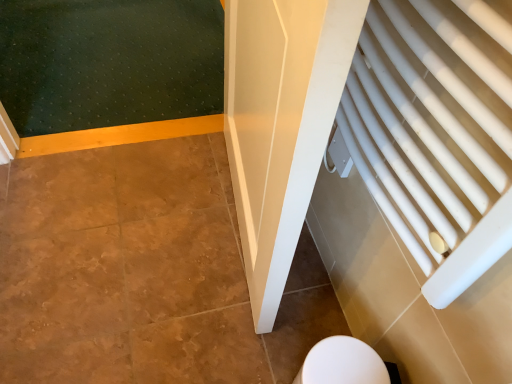
Question: From the image's perspective, is white glossy toilet at lower center located above or below white plastic radiator at right?

Choices:
 (A) below
 (B) above

Answer: (A)

Question: From their relative heights in the image, would you say white glossy toilet at lower center is taller or shorter than white plastic radiator at right?

Choices:
 (A) short
 (B) tall

Answer: (A)

Question: Considering the positions of white glossy toilet at lower center and white plastic radiator at right in the image, is white glossy toilet at lower center bigger or smaller than white plastic radiator at right?

Choices:
 (A) small
 (B) big

Answer: (A)

Question: Based on their sizes in the image, would you say white plastic radiator at right is bigger or smaller than white glossy toilet at lower center?

Choices:
 (A) big
 (B) small

Answer: (A)

Question: Is white plastic radiator at right taller or shorter than white glossy toilet at lower center?

Choices:
 (A) short
 (B) tall

Answer: (B)

Question: Would you say white plastic radiator at right is to the left or to the right of white glossy toilet at lower center in the picture?

Choices:
 (A) right
 (B) left

Answer: (A)

Question: Relative to white glossy toilet at lower center, is white plastic radiator at right in front or behind?

Choices:
 (A) front
 (B) behind

Answer: (A)